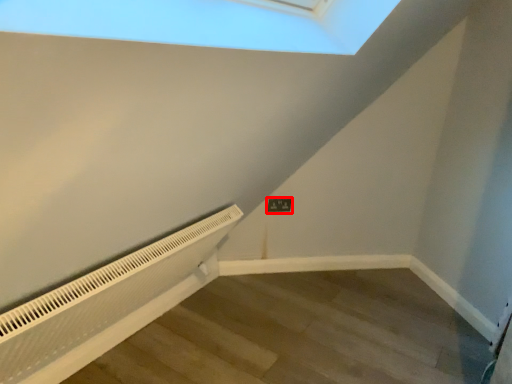
Question: Where is electric outlet (annotated by the red box) located in relation to air conditioner in the image?

Choices:
 (A) left
 (B) right

Answer: (B)